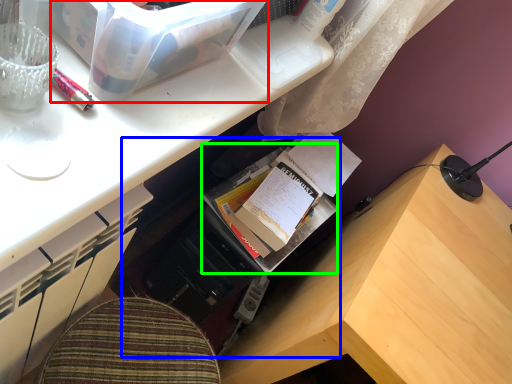
Question: Which object is positioned farthest from storage box (highlighted by a red box)? Select from bookshelf (highlighted by a blue box) and book (highlighted by a green box).

Choices:
 (A) bookshelf
 (B) book

Answer: (A)